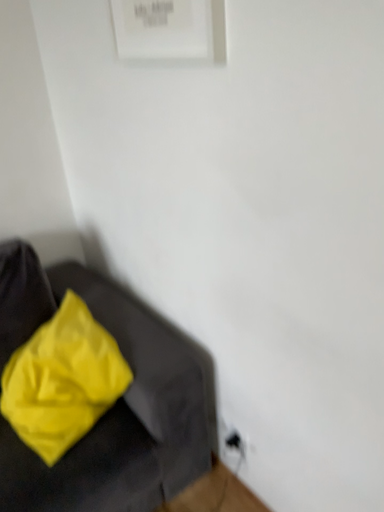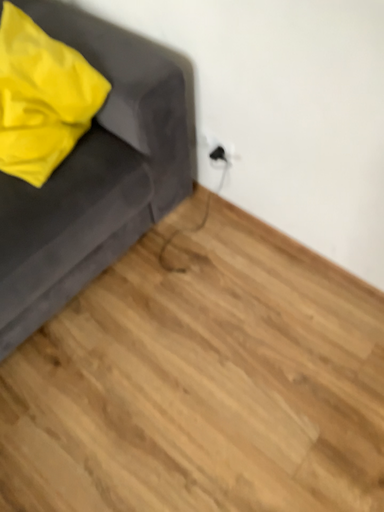
Question: How did the camera likely rotate when shooting the video?

Choices:
 (A) rotated right
 (B) rotated left

Answer: (A)